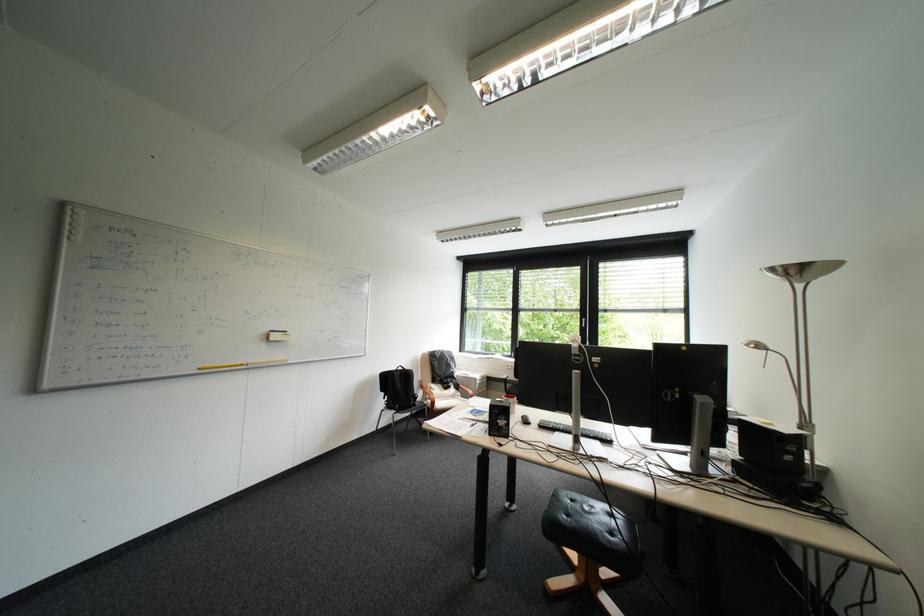
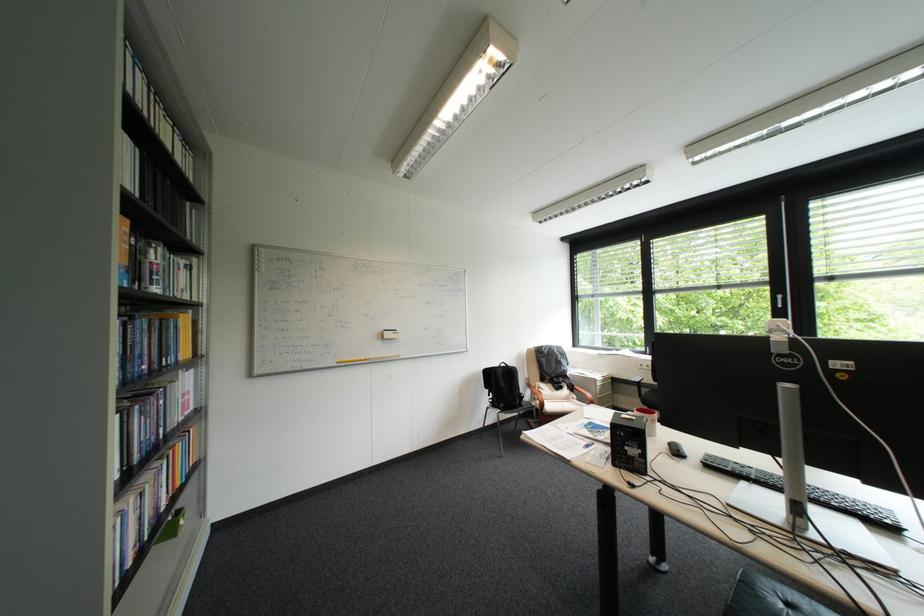
The point at [488,379] is marked in the first image. Where is the corresponding point in the second image?

(608, 379)